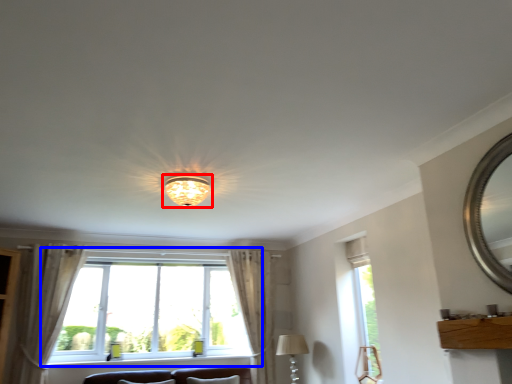
Question: Among these objects, which one is nearest to the camera, lamp (highlighted by a red box) or window (highlighted by a blue box)?

Choices:
 (A) lamp
 (B) window

Answer: (A)